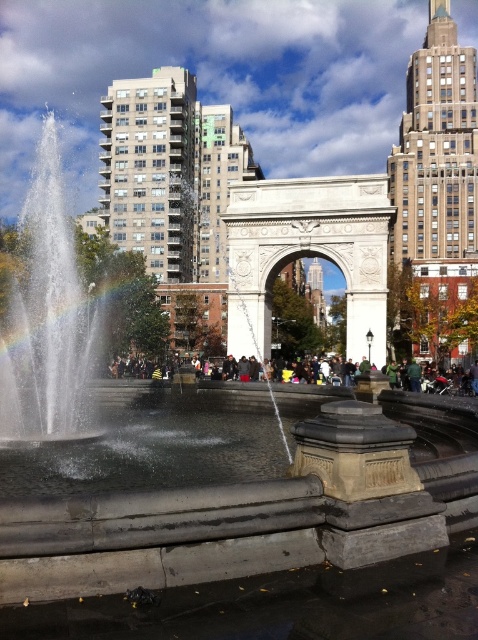
Question: Does rainbow at center appear on the left side of dark green fabric at center?

Choices:
 (A) yes
 (B) no

Answer: (A)

Question: Which object appears farthest from the camera in this image?

Choices:
 (A) dark green fabric at center
 (B) rainbow at center

Answer: (B)

Question: Among these points, which one is nearest to the camera?

Choices:
 (A) (448, 380)
 (B) (133, 288)

Answer: (A)

Question: In this image, where is rainbow at center located relative to dark green fabric at center?

Choices:
 (A) below
 (B) above

Answer: (B)

Question: In this image, where is rainbow at center located relative to dark green fabric at center?

Choices:
 (A) right
 (B) left

Answer: (B)